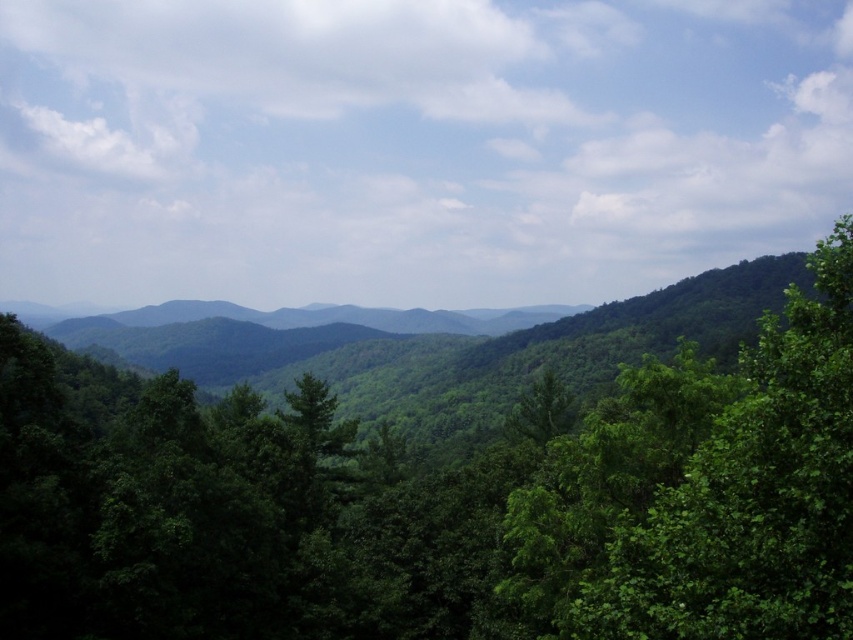
Question: Is green leafy tree at center positioned at the back of green leafy tree at right?

Choices:
 (A) no
 (B) yes

Answer: (B)

Question: Is green leafy tree at center wider than green leafy tree at right?

Choices:
 (A) yes
 (B) no

Answer: (A)

Question: Among these objects, which one is nearest to the camera?

Choices:
 (A) green leafy tree at center
 (B) green leafy tree at right

Answer: (B)

Question: Is green leafy tree at center below green leafy tree at right?

Choices:
 (A) yes
 (B) no

Answer: (A)

Question: Which object is farther from the camera taking this photo?

Choices:
 (A) green leafy tree at right
 (B) green leafy tree at center

Answer: (B)

Question: Which point is closer to the camera?

Choices:
 (A) green leafy tree at right
 (B) green leafy tree at center

Answer: (A)